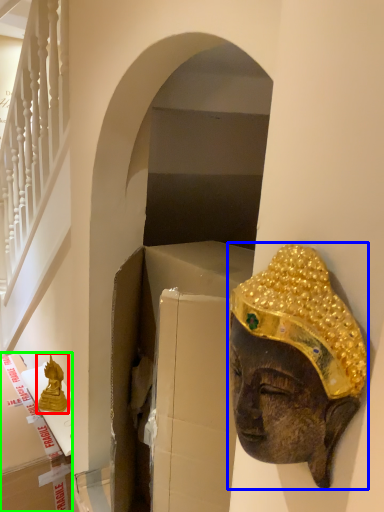
Question: Which object is positioned closest to statue (highlighted by a red box)? Select from person (highlighted by a blue box) and cardboard box (highlighted by a green box).

Choices:
 (A) person
 (B) cardboard box

Answer: (B)